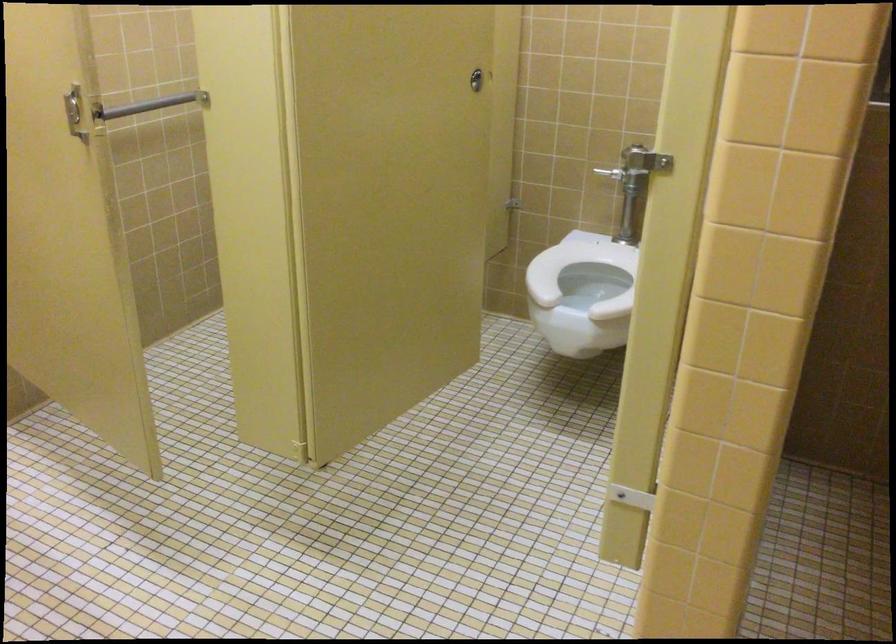
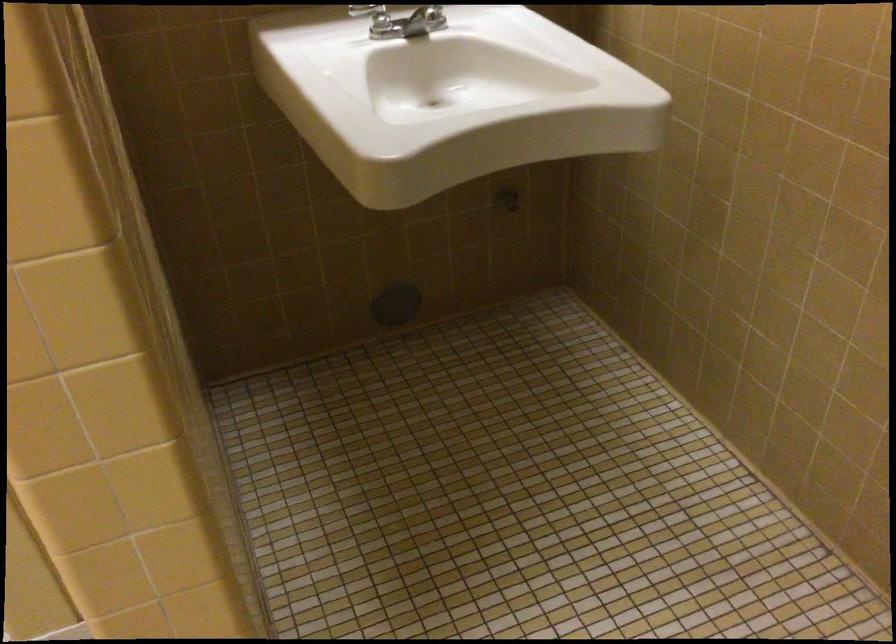
First-person continuous shooting, in which direction is the camera rotating?

The camera's rotation is toward right-down.